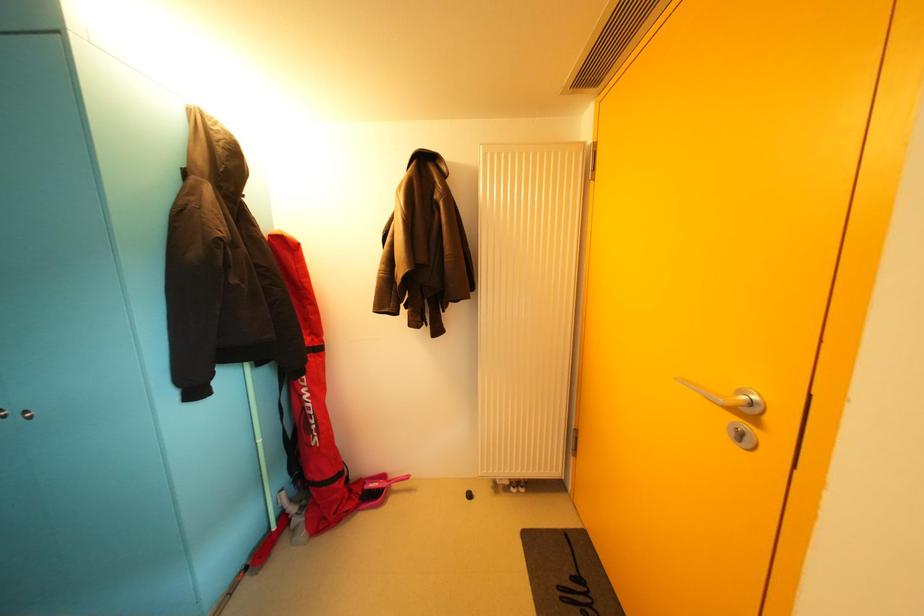
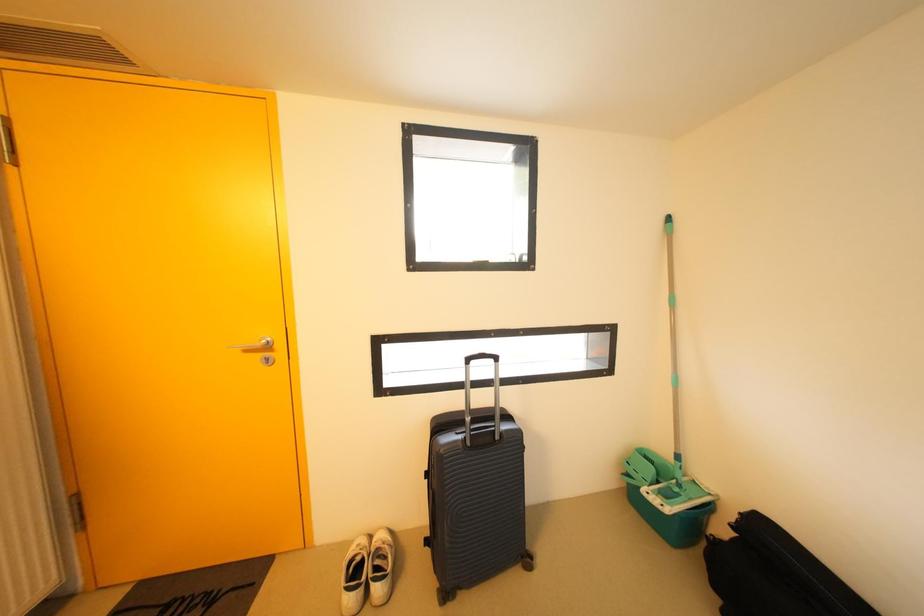
Question: The camera is either moving clockwise (left) or counter-clockwise (right) around the object. The first image is from the beginning of the video and the second image is from the end. Is the camera moving left or right when shooting the video?

Choices:
 (A) Left
 (B) Right

Answer: (A)